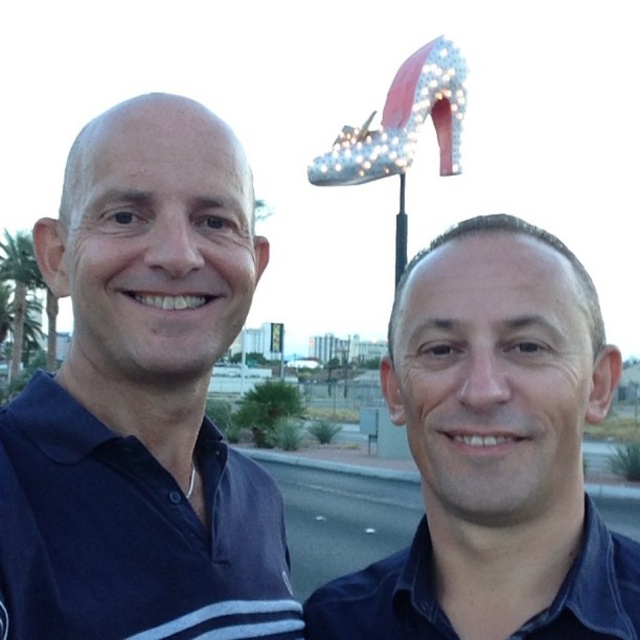
Question: Is blue cotton polo shirt at left in front of navy blue cotton polo shirt at center?

Choices:
 (A) yes
 (B) no

Answer: (B)

Question: Which point appears closest to the camera in this image?

Choices:
 (A) pos(45,385)
 (B) pos(20,468)

Answer: (B)

Question: Which is farther from the blue cotton polo shirt at left?

Choices:
 (A) navy blue cotton polo shirt at center
 (B) green leafy palm tree at left

Answer: (B)

Question: Can you confirm if navy blue cotton polo shirt at center is bigger than green leafy palm tree at left?

Choices:
 (A) no
 (B) yes

Answer: (A)

Question: Which point is farther to the camera?

Choices:
 (A) navy blue cotton polo shirt at center
 (B) green leafy palm tree at left
 (C) blue cotton polo shirt at left

Answer: (B)

Question: In this image, where is blue cotton polo shirt at left located relative to navy blue cotton polo shirt at center?

Choices:
 (A) below
 (B) above

Answer: (B)